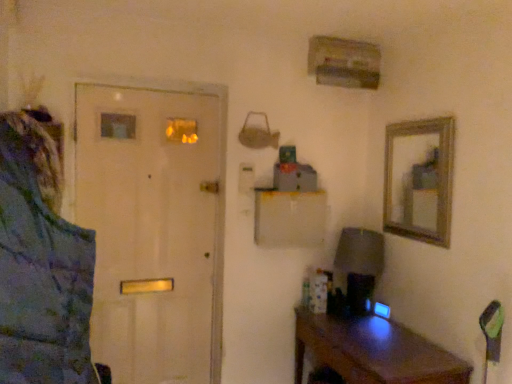
Question: Considering the positions of blue textured jacket at left and brown wooden desk at lower right in the image, is blue textured jacket at left wider or thinner than brown wooden desk at lower right?

Choices:
 (A) thin
 (B) wide

Answer: (A)

Question: In the image, is blue textured jacket at left positioned in front of or behind brown wooden desk at lower right?

Choices:
 (A) behind
 (B) front

Answer: (B)

Question: Which is farther from the matte gray lampshade at right?

Choices:
 (A) white matte door at left
 (B) blue textured jacket at left
 (C) brown wooden desk at lower right

Answer: (B)

Question: Which object is positioned closest to the brown wooden desk at lower right?

Choices:
 (A) blue textured jacket at left
 (B) matte gray lampshade at right
 (C) white matte door at left

Answer: (B)